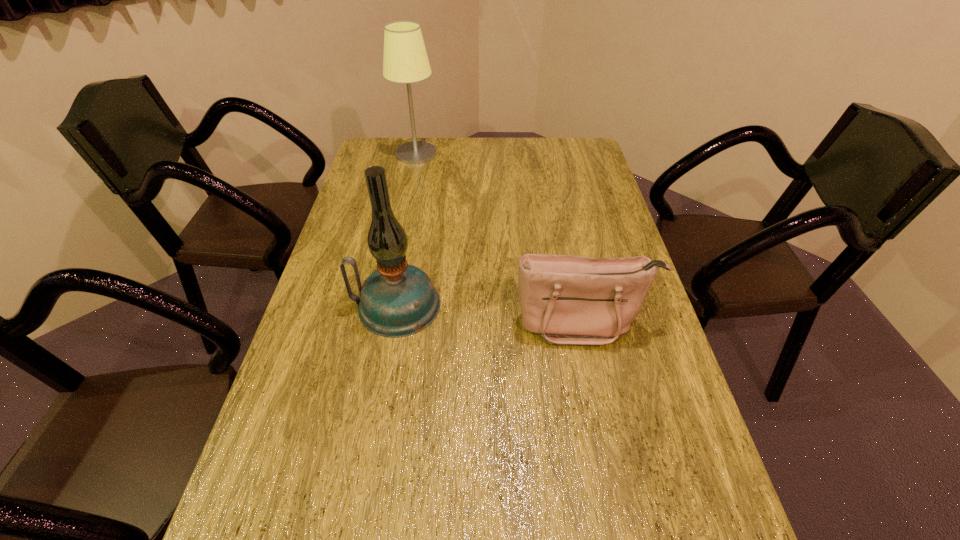
Find the location of a particular element. This screenshot has width=960, height=540. the farthest object is located at coordinates (405, 61).

Find the location of a particular element. oil lamp is located at coordinates [397, 300].

Image resolution: width=960 pixels, height=540 pixels. In order to click on the shortest object in this screenshot , I will do `click(568, 300)`.

Where is `shoulder bag`? The image size is (960, 540). shoulder bag is located at coordinates (568, 300).

This screenshot has height=540, width=960. Identify the location of free space located 0.060m on the front of the farthest object. (412, 174).

The width and height of the screenshot is (960, 540). In order to click on vacant space located 0.370m on the front of the oil lamp in this screenshot , I will do `click(362, 501)`.

Image resolution: width=960 pixels, height=540 pixels. Find the location of `vacant point located on the front pocket of the shoulder bag`. vacant point located on the front pocket of the shoulder bag is located at coordinates (594, 376).

This screenshot has height=540, width=960. I want to click on object located at the far edge, so click(x=405, y=61).

Identify the location of table lamp located in the left edge section of the desktop. The height and width of the screenshot is (540, 960). (405, 61).

Where is `oil lamp at the left edge`? The image size is (960, 540). oil lamp at the left edge is located at coordinates (397, 300).